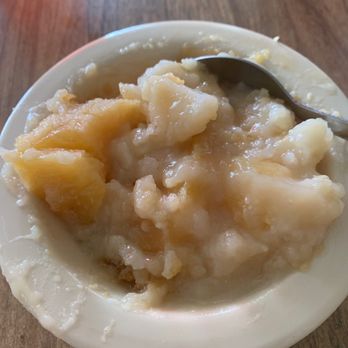
You are a GUI agent. You are given a task and a screenshot of the screen. Output one action in this format:
    pyautogui.click(x=<x>, y=<y>)
    Task: Click on the bowl rim
    
    Given the screenshot: What is the action you would take?
    pyautogui.click(x=319, y=321)